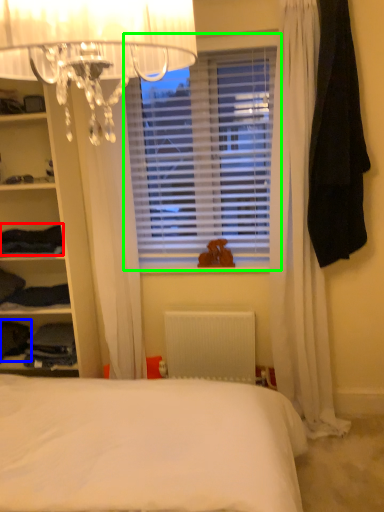
Question: Which is nearer to the clothing (highlighted by a red box)? clothing (highlighted by a blue box) or window blind (highlighted by a green box).

Choices:
 (A) clothing
 (B) window blind

Answer: (A)